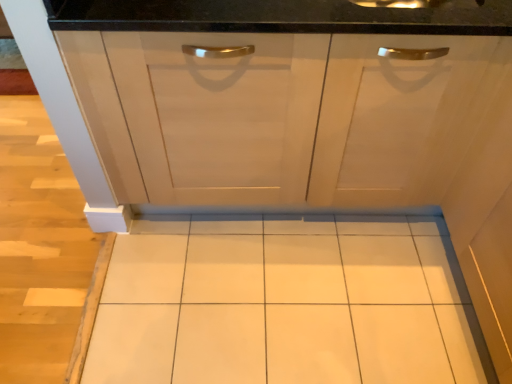
Image resolution: width=512 pixels, height=384 pixels. I want to click on matte white cabinet at center, so click(x=290, y=115).

What do you see at coordinates (290, 115) in the screenshot? Image resolution: width=512 pixels, height=384 pixels. I see `matte white cabinet at center` at bounding box center [290, 115].

In order to face matte white cabinet at center, should I rotate leftwards or rightwards?

Turn right by 3.609 degrees to look at matte white cabinet at center.

What is the approximate width of matte white cabinet at center?

matte white cabinet at center is 26.19 inches wide.

What is the approximate width of white glossy tile at center?

The width of white glossy tile at center is 4.84 feet.

Describe the element at coordinates (283, 303) in the screenshot. I see `white glossy tile at center` at that location.

Where is `white glossy tile at center`? Image resolution: width=512 pixels, height=384 pixels. white glossy tile at center is located at coordinates (283, 303).

You are a GUI agent. You are given a task and a screenshot of the screen. Output one action in this format:
    pyautogui.click(x=<x>, y=<y>)
    Task: Click on the matte white cabinet at center
    Image resolution: width=512 pixels, height=384 pixels.
    Given the screenshot: What is the action you would take?
    pyautogui.click(x=290, y=115)

Considering the relative positions of white glossy tile at center and matte white cabinet at center in the image provided, is white glossy tile at center to the left of matte white cabinet at center from the viewer's perspective?

Indeed, white glossy tile at center is positioned on the left side of matte white cabinet at center.

Which object is further away from the camera, white glossy tile at center or matte white cabinet at center?

Positioned behind is white glossy tile at center.

Is point (184, 302) closer to viewer compared to point (229, 113)?

No, (184, 302) is further to viewer.

From the image's perspective, is white glossy tile at center positioned above or below matte white cabinet at center?

Clearly, from the image's perspective, white glossy tile at center is below matte white cabinet at center.

From a real-world perspective, is white glossy tile at center physically above matte white cabinet at center?

No.

In the scene shown: Which object is thinner, white glossy tile at center or matte white cabinet at center?

Thinner between the two is matte white cabinet at center.

Between white glossy tile at center and matte white cabinet at center, which one has more height?

matte white cabinet at center.

Considering the sizes of objects white glossy tile at center and matte white cabinet at center in the image provided, who is smaller, white glossy tile at center or matte white cabinet at center?

white glossy tile at center is smaller.

Is white glossy tile at center not within matte white cabinet at center?

Absolutely, white glossy tile at center is external to matte white cabinet at center.

Does white glossy tile at center touch matte white cabinet at center?

white glossy tile at center and matte white cabinet at center are clearly separated.

Is white glossy tile at center turned away from matte white cabinet at center?

No, white glossy tile at center's orientation is not away from matte white cabinet at center.

What's the angular difference between white glossy tile at center and matte white cabinet at center's facing directions?

They differ by 90.1 degrees in their facing directions.

How distant is white glossy tile at center from matte white cabinet at center?

white glossy tile at center is 17.74 inches away from matte white cabinet at center.

In order to click on ceramic tile located behind the matte white cabinet at center in this screenshot , I will do `click(283, 303)`.

Which is more to the right, matte white cabinet at center or white glossy tile at center?

Positioned to the right is matte white cabinet at center.

Does matte white cabinet at center come in front of white glossy tile at center?

Yes, matte white cabinet at center is closer to the camera.

Based on the photo, which is closer, (94, 48) or (422, 372)?

Clearly, point (94, 48) is closer to the camera than point (422, 372).

From the image's perspective, is matte white cabinet at center above or below white glossy tile at center?

matte white cabinet at center is above white glossy tile at center.

From a real-world perspective, who is located higher, matte white cabinet at center or white glossy tile at center?

From a 3D spatial view, matte white cabinet at center is above.

Which object is wider, matte white cabinet at center or white glossy tile at center?

white glossy tile at center is wider.

Can you confirm if matte white cabinet at center is shorter than white glossy tile at center?

Incorrect, the height of matte white cabinet at center does not fall short of that of white glossy tile at center.

Considering the sizes of objects matte white cabinet at center and white glossy tile at center in the image provided, who is bigger, matte white cabinet at center or white glossy tile at center?

matte white cabinet at center.

Would you say matte white cabinet at center contains white glossy tile at center?

That's incorrect, white glossy tile at center is not inside matte white cabinet at center.

In the scene shown: Is matte white cabinet at center with white glossy tile at center?

No, matte white cabinet at center is not touching white glossy tile at center.

Is matte white cabinet at center oriented towards white glossy tile at center?

Yes, matte white cabinet at center is turned towards white glossy tile at center.

How many degrees apart are the facing directions of matte white cabinet at center and white glossy tile at center?

They differ by 90.1 degrees in their facing directions.

From the picture: How distant is matte white cabinet at center from white glossy tile at center?

matte white cabinet at center and white glossy tile at center are 17.74 inches apart.

At what (x,y) coordinates should I click in order to perform the action: click on ceramic tile behind the matte white cabinet at center. Please return your answer as a coordinate pair (x, y). Looking at the image, I should click on (283, 303).

You are a GUI agent. You are given a task and a screenshot of the screen. Output one action in this format:
    pyautogui.click(x=<x>, y=<y>)
    Task: Click on the ceramic tile below the matte white cabinet at center (from the image's perspective)
    This screenshot has height=384, width=512.
    Given the screenshot: What is the action you would take?
    pyautogui.click(x=283, y=303)

At what (x,y) coordinates should I click in order to perform the action: click on cabinetry above the white glossy tile at center (from a real-world perspective). Please return your answer as a coordinate pair (x, y). The height and width of the screenshot is (384, 512). Looking at the image, I should click on (290, 115).